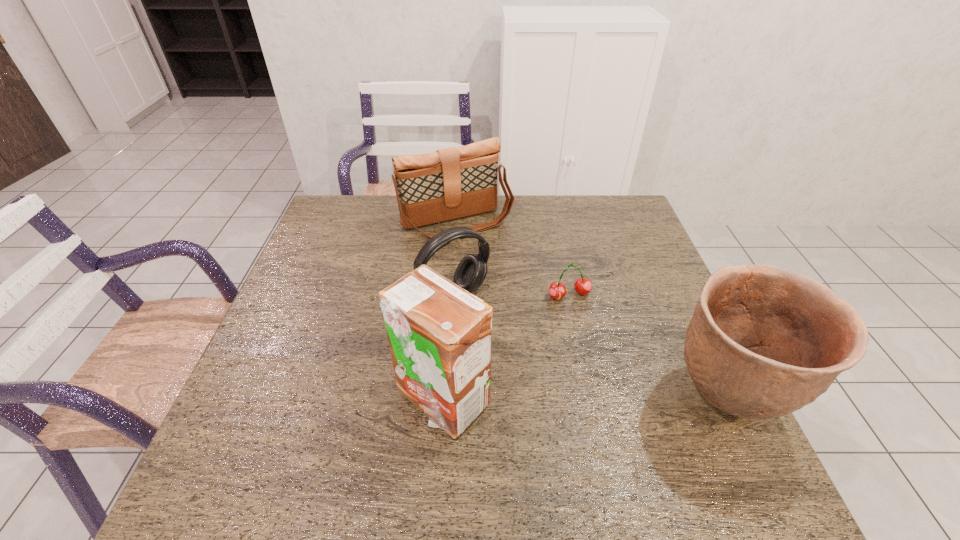
Locate an element on the screen. Image resolution: width=960 pixels, height=540 pixels. carton is located at coordinates (440, 336).

Where is `pottery`? This screenshot has height=540, width=960. pottery is located at coordinates (764, 341).

Where is `shoulder bag`? The width and height of the screenshot is (960, 540). shoulder bag is located at coordinates (448, 184).

Locate an element on the screen. This screenshot has height=540, width=960. cherry is located at coordinates (583, 286).

Where is `the shortest object`? the shortest object is located at coordinates (583, 286).

Find the location of a particular element. the fourth tallest object is located at coordinates (470, 273).

Image resolution: width=960 pixels, height=540 pixels. What are the coordinates of `vacant region located 0.100m on the left of the rightmost object` in the screenshot? It's located at (618, 399).

The height and width of the screenshot is (540, 960). I want to click on free spot located 0.180m on the front-facing side of the farthest object, so click(500, 277).

This screenshot has width=960, height=540. Identify the location of vacant region located 0.150m on the front-facing side of the farthest object. (496, 271).

I want to click on vacant space located 0.320m on the front-facing side of the farthest object, so 521,311.